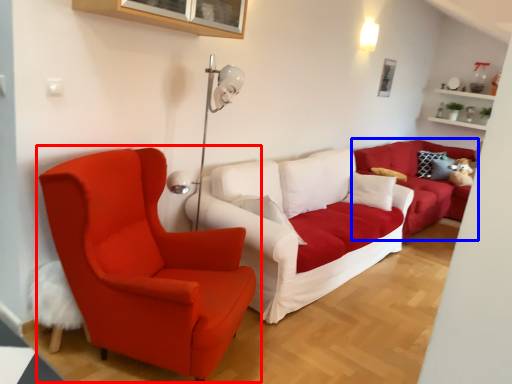
Question: Which of the following is the closest to the observer, chair (highlighted by a red box) or studio couch (highlighted by a blue box)?

Choices:
 (A) chair
 (B) studio couch

Answer: (A)